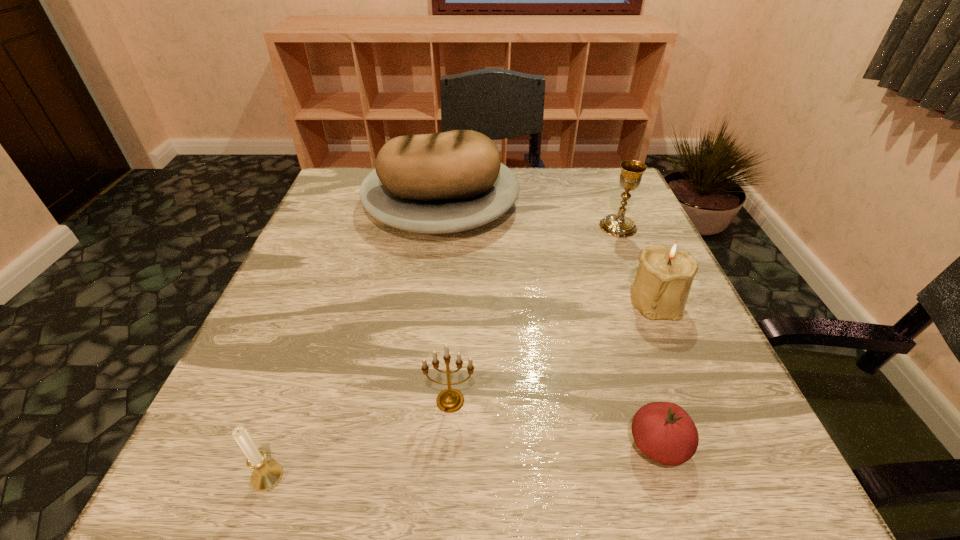
Where is `bread`? The image size is (960, 540). bread is located at coordinates (454, 181).

You are a GUI agent. You are given a task and a screenshot of the screen. Output one action in this format:
    pyautogui.click(x=<x>, y=<y>)
    Task: Click on the chalice
    This screenshot has height=540, width=960.
    Given the screenshot: What is the action you would take?
    pyautogui.click(x=618, y=225)

Where is `the rightmost candle holder`? The height and width of the screenshot is (540, 960). the rightmost candle holder is located at coordinates (665, 274).

Where is `the third farthest object`? The height and width of the screenshot is (540, 960). the third farthest object is located at coordinates (665, 274).

Identify the location of the second candle holder from left to right. This screenshot has width=960, height=540. (450, 400).

In order to click on the second nearest candle holder in this screenshot , I will do `click(450, 400)`.

At what (x,y) coordinates should I click in order to perform the action: click on the nearest candle holder. Please return your answer as a coordinate pair (x, y). The image size is (960, 540). Looking at the image, I should click on (267, 474).

Locate an element on the screen. tomato is located at coordinates (663, 431).

Find the location of `vacant space situated 0.050m on the front of the bread`. vacant space situated 0.050m on the front of the bread is located at coordinates (434, 265).

Find the location of a particular element. The image size is (960, 540). vacant point located 0.270m on the front of the chalice is located at coordinates (659, 326).